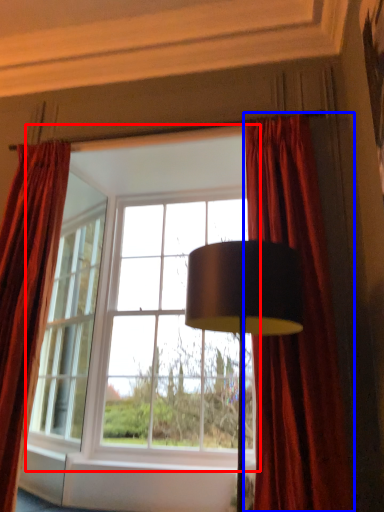
Question: Among these objects, which one is farthest to the camera, window (highlighted by a red box) or curtain (highlighted by a blue box)?

Choices:
 (A) window
 (B) curtain

Answer: (A)